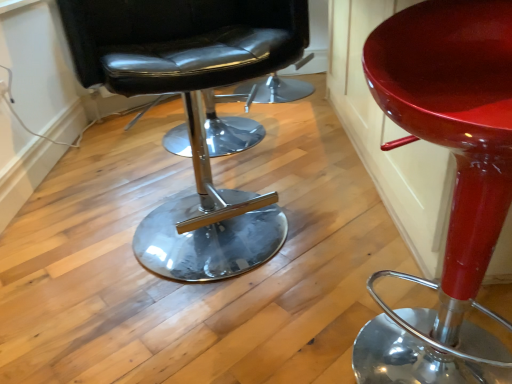
The width and height of the screenshot is (512, 384). Describe the element at coordinates (192, 112) in the screenshot. I see `black leather chair at center, which is counted as the 1th chair, starting from the left` at that location.

How much space does black leather chair at center, placed as the 2th chair when sorted from right to left, occupy horizontally?

It is 60.73 centimeters.

Find the location of a particular element. This screenshot has width=512, height=384. black leather chair at center, which is counted as the 1th chair, starting from the left is located at coordinates (192, 112).

Measure the distance between point (181, 261) and camera.

The depth of point (181, 261) is 4.42 feet.

Identify the location of glossy red stool at center, placed as the second chair when sorted from left to right. The height and width of the screenshot is (384, 512). (455, 184).

The height and width of the screenshot is (384, 512). What do you see at coordinates (455, 184) in the screenshot? I see `glossy red stool at center, acting as the 1th chair starting from the right` at bounding box center [455, 184].

You are a GUI agent. You are given a task and a screenshot of the screen. Output one action in this format:
    pyautogui.click(x=<x>, y=<y>)
    Task: Click on the black leather chair at center, which is counted as the 1th chair, starting from the left
    The image size is (512, 384).
    Given the screenshot: What is the action you would take?
    pyautogui.click(x=192, y=112)

Can you confirm if glossy red stool at center, acting as the 1th chair starting from the right, is positioned to the right of black leather chair at center, which is counted as the 1th chair, starting from the left?

Correct, you'll find glossy red stool at center, acting as the 1th chair starting from the right, to the right of black leather chair at center, which is counted as the 1th chair, starting from the left.

Relative to black leather chair at center, which is counted as the 1th chair, starting from the left, is glossy red stool at center, placed as the second chair when sorted from left to right, in front or behind?

In the image, glossy red stool at center, placed as the second chair when sorted from left to right, appears in front of black leather chair at center, which is counted as the 1th chair, starting from the left.

Does point (451, 119) come farther from viewer compared to point (234, 62)?

No, (451, 119) is closer to viewer.

From the image's perspective, is glossy red stool at center, acting as the 1th chair starting from the right, positioned above or below black leather chair at center, placed as the 2th chair when sorted from right to left?

From the image's perspective, glossy red stool at center, acting as the 1th chair starting from the right, appears below black leather chair at center, placed as the 2th chair when sorted from right to left.

From a real-world perspective, between glossy red stool at center, placed as the second chair when sorted from left to right, and black leather chair at center, which is counted as the 1th chair, starting from the left, who is vertically higher?

black leather chair at center, which is counted as the 1th chair, starting from the left, is physically above.

Which object is wider, glossy red stool at center, acting as the 1th chair starting from the right, or black leather chair at center, which is counted as the 1th chair, starting from the left?

black leather chair at center, which is counted as the 1th chair, starting from the left, is wider.

In terms of height, does glossy red stool at center, placed as the second chair when sorted from left to right, look taller or shorter compared to black leather chair at center, placed as the 2th chair when sorted from right to left?

In the image, glossy red stool at center, placed as the second chair when sorted from left to right, appears to be shorter than black leather chair at center, placed as the 2th chair when sorted from right to left.

Who is smaller, glossy red stool at center, placed as the second chair when sorted from left to right, or black leather chair at center, placed as the 2th chair when sorted from right to left?

glossy red stool at center, placed as the second chair when sorted from left to right.

Would you say glossy red stool at center, placed as the second chair when sorted from left to right, contains black leather chair at center, placed as the 2th chair when sorted from right to left?

No, glossy red stool at center, placed as the second chair when sorted from left to right, does not contain black leather chair at center, placed as the 2th chair when sorted from right to left.

Is glossy red stool at center, placed as the second chair when sorted from left to right, next to black leather chair at center, which is counted as the 1th chair, starting from the left, and touching it?

No, glossy red stool at center, placed as the second chair when sorted from left to right, is not making contact with black leather chair at center, which is counted as the 1th chair, starting from the left.

Could you tell me if glossy red stool at center, placed as the second chair when sorted from left to right, is turned towards black leather chair at center, placed as the 2th chair when sorted from right to left?

No, glossy red stool at center, placed as the second chair when sorted from left to right, is not oriented towards black leather chair at center, placed as the 2th chair when sorted from right to left.

How different are the orientations of glossy red stool at center, placed as the second chair when sorted from left to right, and black leather chair at center, placed as the 2th chair when sorted from right to left, in degrees?

The angle between the facing direction of glossy red stool at center, placed as the second chair when sorted from left to right, and the facing direction of black leather chair at center, placed as the 2th chair when sorted from right to left, is 23.3 degrees.

Locate an element on the screen. Image resolution: width=512 pixels, height=384 pixels. chair on the left of glossy red stool at center, acting as the 1th chair starting from the right is located at coordinates (192, 112).

Between black leather chair at center, which is counted as the 1th chair, starting from the left, and glossy red stool at center, acting as the 1th chair starting from the right, which one appears on the right side from the viewer's perspective?

Positioned to the right is glossy red stool at center, acting as the 1th chair starting from the right.

Which is behind, black leather chair at center, placed as the 2th chair when sorted from right to left, or glossy red stool at center, placed as the second chair when sorted from left to right?

black leather chair at center, placed as the 2th chair when sorted from right to left, is further from the camera.

Is point (84, 25) farther from viewer compared to point (436, 355)?

No, it is not.

In the scene shown: From the image's perspective, is black leather chair at center, which is counted as the 1th chair, starting from the left, located above glossy red stool at center, placed as the second chair when sorted from left to right?

Yes, from the image's perspective, black leather chair at center, which is counted as the 1th chair, starting from the left, is over glossy red stool at center, placed as the second chair when sorted from left to right.

In the scene shown: From a real-world perspective, who is located lower, black leather chair at center, which is counted as the 1th chair, starting from the left, or glossy red stool at center, placed as the second chair when sorted from left to right?

In real-world perspective, glossy red stool at center, placed as the second chair when sorted from left to right, is lower.

Which of these two, black leather chair at center, which is counted as the 1th chair, starting from the left, or glossy red stool at center, placed as the second chair when sorted from left to right, is thinner?

Thinner between the two is glossy red stool at center, placed as the second chair when sorted from left to right.

Considering the sizes of objects black leather chair at center, which is counted as the 1th chair, starting from the left, and glossy red stool at center, acting as the 1th chair starting from the right, in the image provided, who is taller, black leather chair at center, which is counted as the 1th chair, starting from the left, or glossy red stool at center, acting as the 1th chair starting from the right,?

With more height is black leather chair at center, which is counted as the 1th chair, starting from the left.

In the scene shown: Who is smaller, black leather chair at center, which is counted as the 1th chair, starting from the left, or glossy red stool at center, placed as the second chair when sorted from left to right?

glossy red stool at center, placed as the second chair when sorted from left to right, is smaller.

Choose the correct answer: Is black leather chair at center, which is counted as the 1th chair, starting from the left, inside glossy red stool at center, acting as the 1th chair starting from the right, or outside it?

black leather chair at center, which is counted as the 1th chair, starting from the left, is not inside glossy red stool at center, acting as the 1th chair starting from the right, it's outside.

Is black leather chair at center, which is counted as the 1th chair, starting from the left, far from glossy red stool at center, placed as the second chair when sorted from left to right?

No, black leather chair at center, which is counted as the 1th chair, starting from the left, is not far from glossy red stool at center, placed as the second chair when sorted from left to right.

Is black leather chair at center, which is counted as the 1th chair, starting from the left, aimed at glossy red stool at center, acting as the 1th chair starting from the right?

Yes, black leather chair at center, which is counted as the 1th chair, starting from the left, is aimed at glossy red stool at center, acting as the 1th chair starting from the right.

What's the angular difference between black leather chair at center, which is counted as the 1th chair, starting from the left, and glossy red stool at center, acting as the 1th chair starting from the right,'s facing directions?

They differ by 23.3 degrees in their facing directions.

Measure the distance between black leather chair at center, which is counted as the 1th chair, starting from the left, and glossy red stool at center, acting as the 1th chair starting from the right.

The distance of black leather chair at center, which is counted as the 1th chair, starting from the left, from glossy red stool at center, acting as the 1th chair starting from the right, is 23.12 inches.

At what (x,y) coordinates should I click in order to perform the action: click on chair that appears above the glossy red stool at center, placed as the second chair when sorted from left to right (from a real-world perspective). Please return your answer as a coordinate pair (x, y). This screenshot has height=384, width=512. Looking at the image, I should click on (192, 112).

You are a GUI agent. You are given a task and a screenshot of the screen. Output one action in this format:
    pyautogui.click(x=<x>, y=<y>)
    Task: Click on the chair in front of the black leather chair at center, placed as the 2th chair when sorted from right to left
    This screenshot has width=512, height=384.
    Given the screenshot: What is the action you would take?
    pyautogui.click(x=455, y=184)

Identify the location of chair to the left of glossy red stool at center, acting as the 1th chair starting from the right. The height and width of the screenshot is (384, 512). (192, 112).